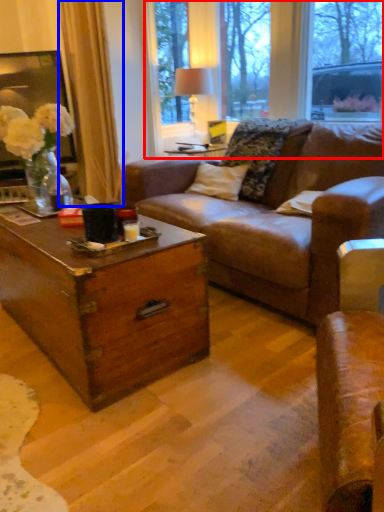
Question: Among these objects, which one is farthest to the camera, bay window (highlighted by a red box) or curtain (highlighted by a blue box)?

Choices:
 (A) bay window
 (B) curtain

Answer: (B)